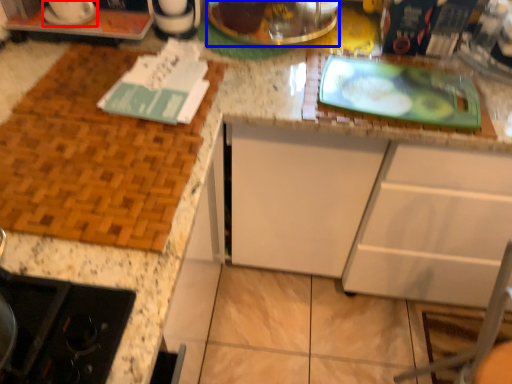
Question: Which object appears farthest to the camera in this image, appliance (highlighted by a red box) or appliance (highlighted by a blue box)?

Choices:
 (A) appliance
 (B) appliance

Answer: (B)